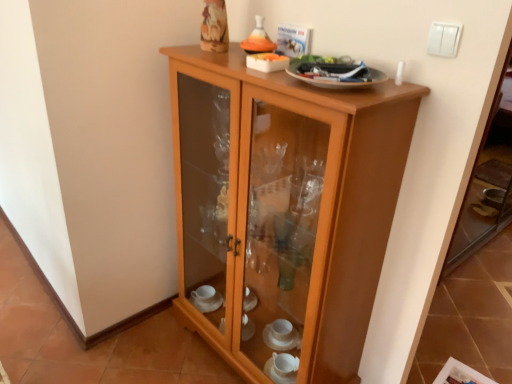
The height and width of the screenshot is (384, 512). Describe the element at coordinates (284, 207) in the screenshot. I see `light brown wood cupboard at center` at that location.

Find the location of a particular element. The image size is (512, 384). light brown wood cupboard at center is located at coordinates (284, 207).

Consider the image. What is the approximate width of light brown wood cupboard at center?

13.37 inches.

This screenshot has width=512, height=384. Describe the element at coordinates (444, 39) in the screenshot. I see `white plastic light switch at upper right` at that location.

Find the location of a particular element. Image resolution: width=512 pixels, height=384 pixels. white plastic light switch at upper right is located at coordinates (444, 39).

In order to face white plastic light switch at upper right, should I rotate leftwards or rightwards?

You should rotate right by 23.773 degrees.

Image resolution: width=512 pixels, height=384 pixels. What are the coordinates of `light brown wood cupboard at center` in the screenshot? It's located at (284, 207).

Can you confirm if light brown wood cupboard at center is positioned to the left of white plastic light switch at upper right?

Yes, light brown wood cupboard at center is to the left of white plastic light switch at upper right.

Relative to white plastic light switch at upper right, is light brown wood cupboard at center in front or behind?

In the image, light brown wood cupboard at center appears in front of white plastic light switch at upper right.

Considering the points (364, 167) and (428, 43), which point is behind, point (364, 167) or point (428, 43)?

Point (364, 167)

From the image's perspective, which object appears higher, light brown wood cupboard at center or white plastic light switch at upper right?

white plastic light switch at upper right appears higher in the image.

From a real-world perspective, which is physically above, light brown wood cupboard at center or white plastic light switch at upper right?

white plastic light switch at upper right is physically above.

Looking at this image, which object is thinner, light brown wood cupboard at center or white plastic light switch at upper right?

white plastic light switch at upper right.

Considering the relative sizes of light brown wood cupboard at center and white plastic light switch at upper right in the image provided, is light brown wood cupboard at center taller than white plastic light switch at upper right?

Yes.

Can you confirm if light brown wood cupboard at center is smaller than white plastic light switch at upper right?

Incorrect, light brown wood cupboard at center is not smaller in size than white plastic light switch at upper right.

Does light brown wood cupboard at center contain white plastic light switch at upper right?

Actually, white plastic light switch at upper right is outside light brown wood cupboard at center.

Is light brown wood cupboard at center not close to white plastic light switch at upper right?

No.

Is light brown wood cupboard at center oriented towards white plastic light switch at upper right?

No, light brown wood cupboard at center is not facing towards white plastic light switch at upper right.

How many degrees apart are the facing directions of light brown wood cupboard at center and white plastic light switch at upper right?

0.0016 degrees.

Find the location of a particular element. light switch that appears on the right of light brown wood cupboard at center is located at coordinates (444, 39).

Which object is positioned more to the left, white plastic light switch at upper right or light brown wood cupboard at center?

light brown wood cupboard at center.

Is white plastic light switch at upper right further to camera compared to light brown wood cupboard at center?

Yes, white plastic light switch at upper right is behind light brown wood cupboard at center.

Is point (456, 46) less distant than point (184, 129)?

That is True.

From the image's perspective, would you say white plastic light switch at upper right is shown under light brown wood cupboard at center?

No, from the image's perspective, white plastic light switch at upper right is not beneath light brown wood cupboard at center.

From a real-world perspective, which is physically below, white plastic light switch at upper right or light brown wood cupboard at center?

light brown wood cupboard at center.

Between white plastic light switch at upper right and light brown wood cupboard at center, which one has larger width?

light brown wood cupboard at center is wider.

Does white plastic light switch at upper right have a lesser height compared to light brown wood cupboard at center?

Yes.

Can you confirm if white plastic light switch at upper right is smaller than light brown wood cupboard at center?

Yes.

Is white plastic light switch at upper right positioned beyond the bounds of light brown wood cupboard at center?

Yes, white plastic light switch at upper right is outside of light brown wood cupboard at center.

Are white plastic light switch at upper right and light brown wood cupboard at center far apart?

No, white plastic light switch at upper right is not far from light brown wood cupboard at center.

Based on the photo, is white plastic light switch at upper right looking in the opposite direction of light brown wood cupboard at center?

No, white plastic light switch at upper right is not facing away from light brown wood cupboard at center.

What's the angular difference between white plastic light switch at upper right and light brown wood cupboard at center's facing directions?

There is a 0.0016-degree angle between the facing directions of white plastic light switch at upper right and light brown wood cupboard at center.

At what (x,y) coordinates should I click in order to perform the action: click on cupboard in front of the white plastic light switch at upper right. Please return your answer as a coordinate pair (x, y). The height and width of the screenshot is (384, 512). Looking at the image, I should click on (284, 207).

Image resolution: width=512 pixels, height=384 pixels. In order to click on light switch on the right side of light brown wood cupboard at center in this screenshot , I will do `click(444, 39)`.

Find the location of `light switch behind the light brown wood cupboard at center`. light switch behind the light brown wood cupboard at center is located at coordinates (444, 39).